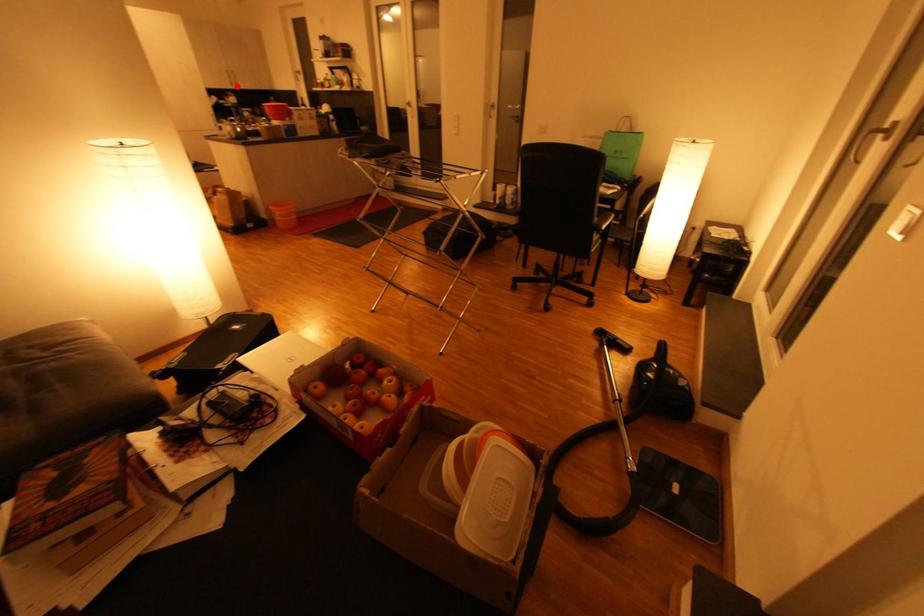
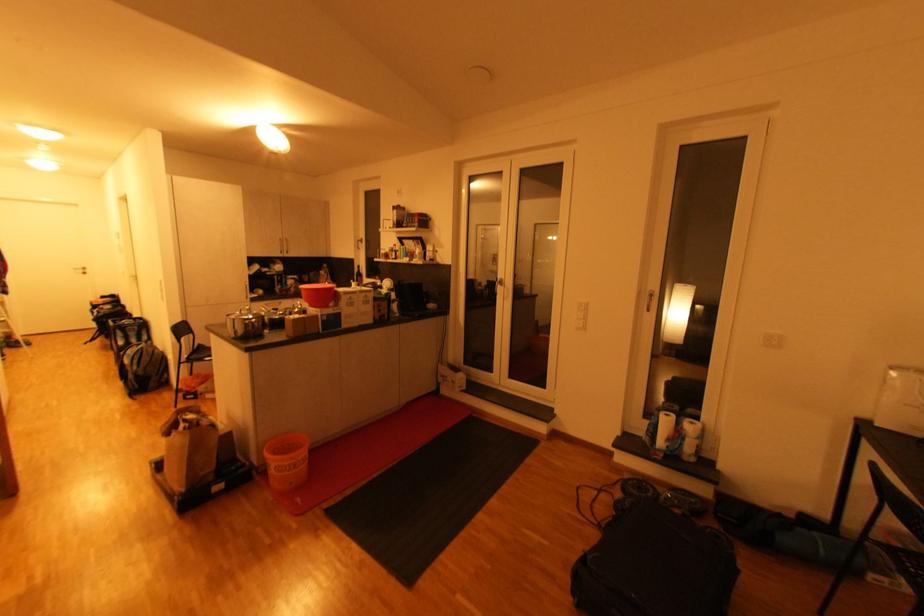
Find the pixel in the second image that matches the highlighted location in the first image.

(286, 254)